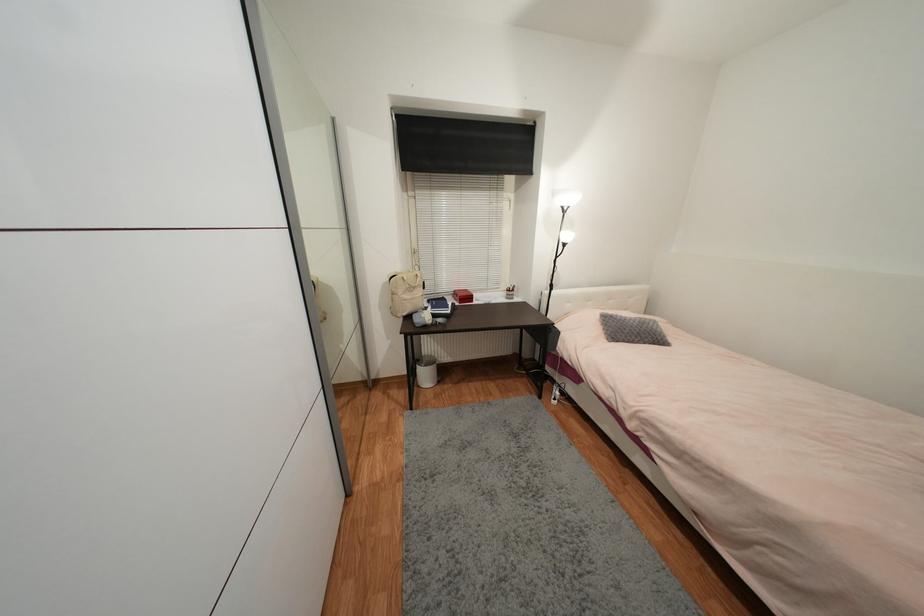
Where would you lift the silver trash can? Please return your answer as a coordinate pair (x, y).

(426, 371)